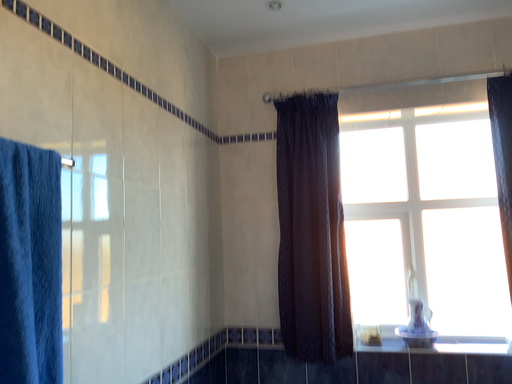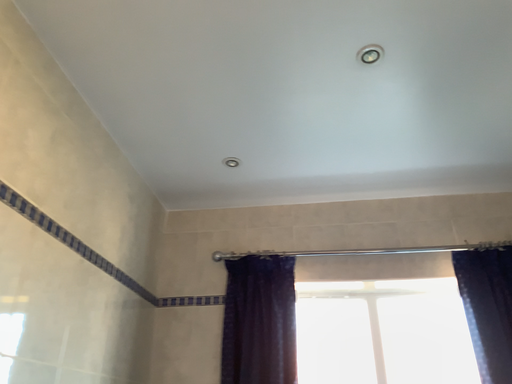
Question: Which way did the camera rotate in the video?

Choices:
 (A) rotated left
 (B) rotated right

Answer: (B)